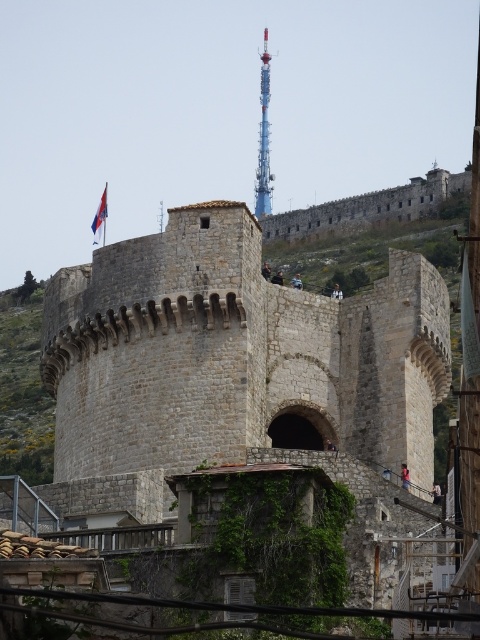
You are a drone operator tasked with capturing aerial footage of the stone castle at center and the red fabric flag at upper left. To ensure both are in frame, you need to know their relative widths. Which object is wider?

The stone castle at center might be wider than red fabric flag at upper left according to the description.

From the picture: You are a tourist standing in front of the stone castle at center and the blue metallic tower at center. Which one is positioned more to the east? Please explain your reasoning based on their relative positions.

The stone castle at center is to the left of the blue metallic tower at center. Assuming the tourist is facing the structures with the castle on their left and the tower on their right, the stone castle at center would be positioned more to the east if the tourist is facing north. However, without knowing the exact orientation, the castle is described as being to the left of the tower in the image, which typically corresponds to the east direction if the image is viewed with standard orientation where left

You are an architect visiting the historic site and want to take a photo of the stone castle at center. However, you notice the red fabric flag at upper left might block part of the castle in your shot. Is the flag in front of or behind the castle?

The stone castle at center is in front of the red fabric flag at upper left, so the flag is behind the castle and won not block it.